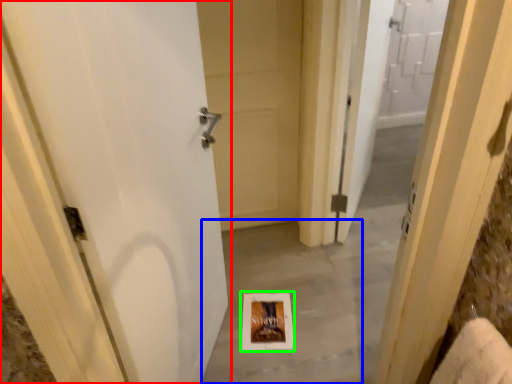
Question: Estimate the real-world distances between objects in this image. Which object is closer to door (highlighted by a red box), concrete (highlighted by a blue box) or picture frame (highlighted by a green box)?

Choices:
 (A) concrete
 (B) picture frame

Answer: (A)